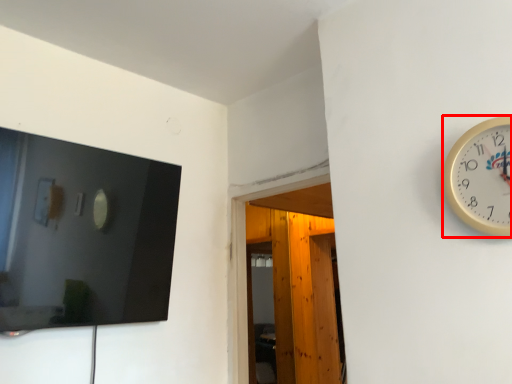
Question: From the image's perspective, considering the relative positions of wall clock (annotated by the red box) and glass door in the image provided, where is wall clock (annotated by the red box) located with respect to the staircase?

Choices:
 (A) above
 (B) below

Answer: (A)